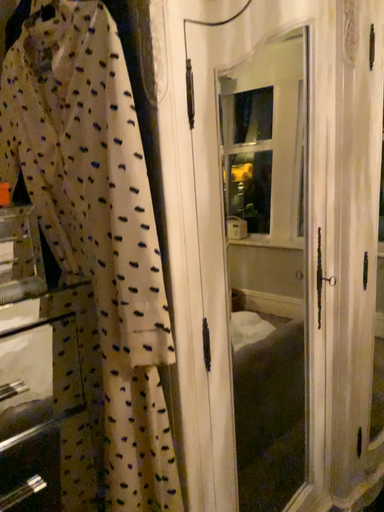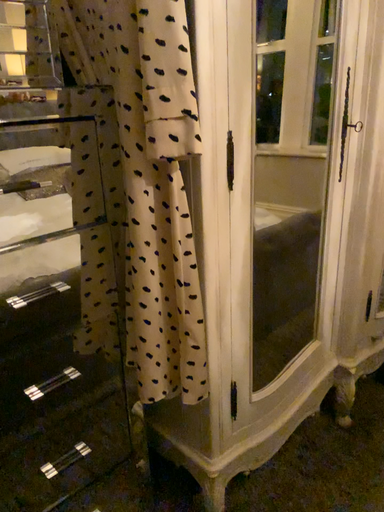
Question: How did the camera likely rotate when shooting the video?

Choices:
 (A) rotated upward
 (B) rotated downward

Answer: (B)